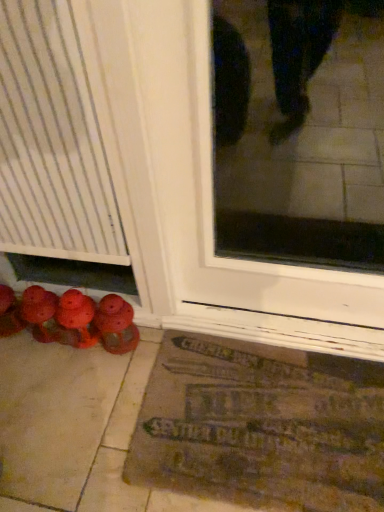
Identify the location of blank space to the left of brown textured mat at lower center. Image resolution: width=384 pixels, height=512 pixels. (84, 422).